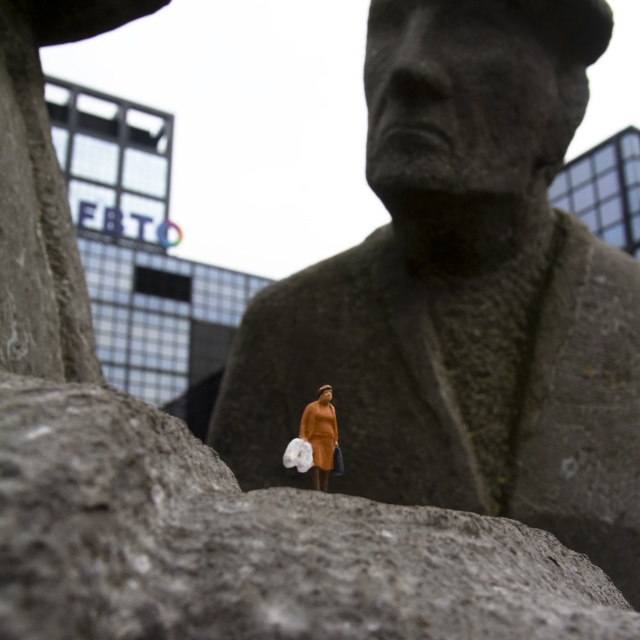
Is matte gray stone bust at center above orange fabric dress at center?

Indeed, matte gray stone bust at center is positioned over orange fabric dress at center.

Is point (416, 308) more distant than point (330, 417)?

Yes, point (416, 308) is farther from viewer.

Locate an element on the screen. This screenshot has height=640, width=640. matte gray stone bust at center is located at coordinates (464, 294).